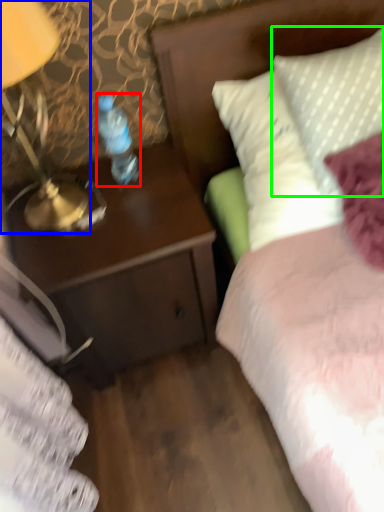
Question: Which is nearer to the bottle (highlighted by a red box)? lamp (highlighted by a blue box) or pillow (highlighted by a green box).

Choices:
 (A) lamp
 (B) pillow

Answer: (A)